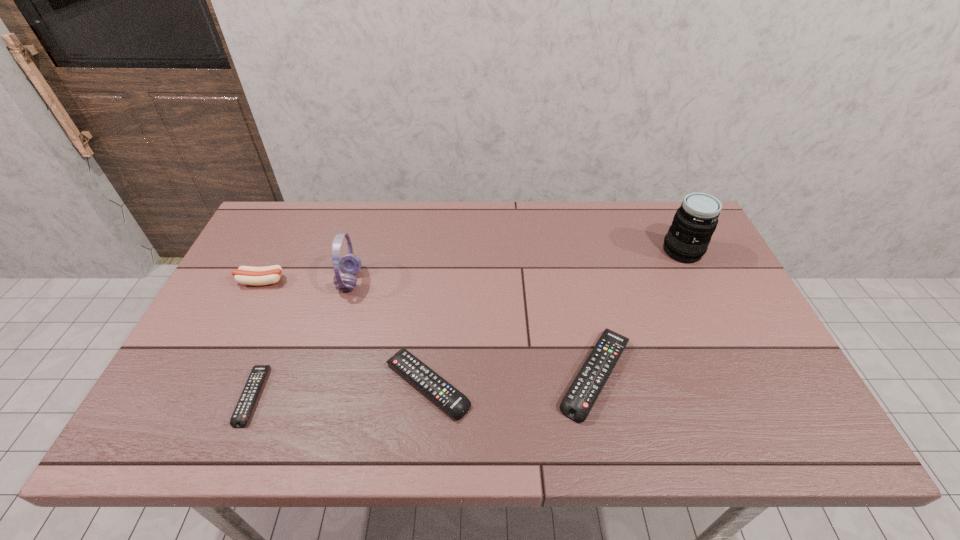
Find the location of a particular element. empty space between the sausage and the telephoto lens is located at coordinates (471, 266).

This screenshot has height=540, width=960. What are the coordinates of `empty location between the rightmost object and the second tallest object` in the screenshot? It's located at (516, 266).

Find the location of `vacant space that is in between the fourth object from right to left and the second tallest remote control`. vacant space that is in between the fourth object from right to left and the second tallest remote control is located at coordinates (389, 333).

This screenshot has width=960, height=540. Identify the location of empty location between the shortest object and the second shortest remote control. (340, 390).

Find the location of a particular element. blank region between the rightmost object and the second tallest object is located at coordinates (516, 266).

You are a GUI agent. You are given a task and a screenshot of the screen. Output one action in this format:
    pyautogui.click(x=<x>, y=<y>)
    Task: Click on the vacant space that is in between the rightmost remote control and the fourth object from right to left
    Image resolution: width=960 pixels, height=540 pixels.
    Given the screenshot: What is the action you would take?
    pyautogui.click(x=473, y=327)

Identify the location of unoccupied position between the second shortest remote control and the second tallest object. (389, 333).

Image resolution: width=960 pixels, height=540 pixels. I want to click on object that can be found as the fifth closest to the second shortest remote control, so click(x=687, y=240).

Where is `the third closest object to the telephoto lens`? This screenshot has width=960, height=540. the third closest object to the telephoto lens is located at coordinates (349, 264).

I want to click on remote control that can be found as the second closest to the leftmost object, so click(x=450, y=399).